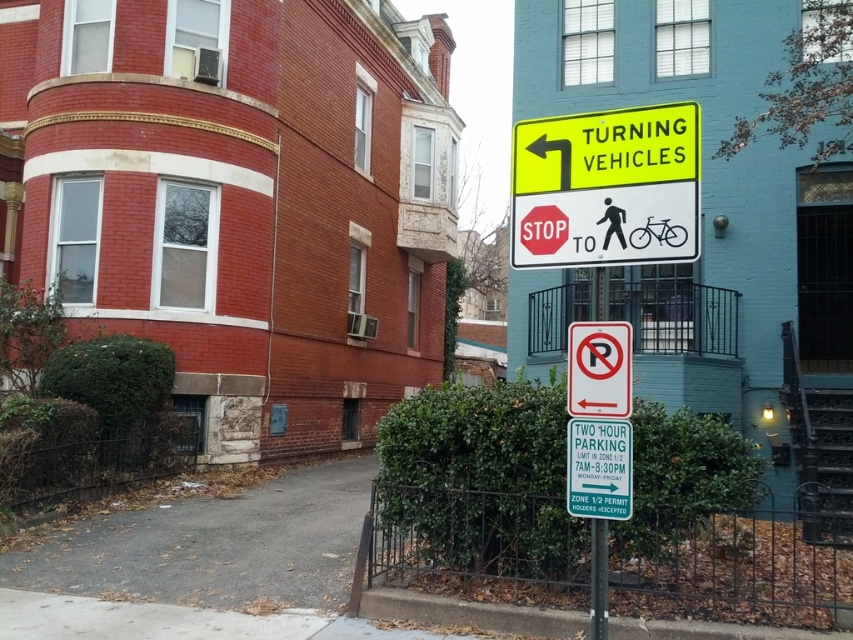
Where is `yellow reflective plastic sign at upper center`? This screenshot has height=640, width=853. yellow reflective plastic sign at upper center is located at coordinates (606, 188).

Which of these two, yellow reflective plastic sign at upper center or green plastic sign at center, stands shorter?

green plastic sign at center is shorter.

Between point (614, 189) and point (625, 461), which one is positioned in front?

Point (625, 461) is in front.

At what (x,y) coordinates should I click in order to perform the action: click on yellow reflective plastic sign at upper center. Please return your answer as a coordinate pair (x, y). The image size is (853, 640). Looking at the image, I should click on 606,188.

Is yellow reflective plastic sign at upper center closer to camera compared to white paper no-parking sign at upper center?

Yes, yellow reflective plastic sign at upper center is in front of white paper no-parking sign at upper center.

The image size is (853, 640). What are the coordinates of `yellow reflective plastic sign at upper center` in the screenshot? It's located at (606, 188).

In order to click on yellow reflective plastic sign at upper center in this screenshot , I will do pyautogui.click(x=606, y=188).

Is green plastic sign at center above white paper no-parking sign at upper center?

No, green plastic sign at center is not above white paper no-parking sign at upper center.

Does green plastic sign at center have a smaller size compared to white paper no-parking sign at upper center?

Correct, green plastic sign at center occupies less space than white paper no-parking sign at upper center.

Find the location of `green plastic sign at center`. green plastic sign at center is located at coordinates (599, 468).